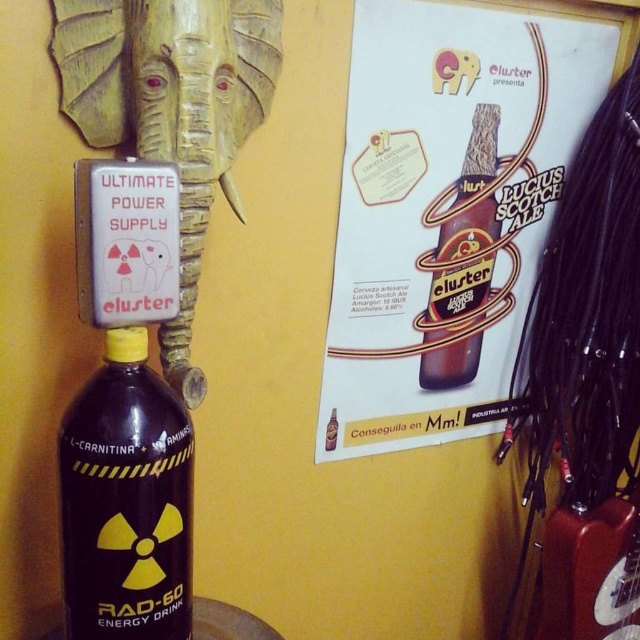
Question: Does matte paper poster at upper right appear under brown glass bottle at upper center?

Choices:
 (A) yes
 (B) no

Answer: (B)

Question: Is matte paper poster at upper right bigger than wooden elephant head at upper left?

Choices:
 (A) no
 (B) yes

Answer: (B)

Question: Considering the real-world distances, which object is farthest from the wooden elephant head at upper left?

Choices:
 (A) matte paper poster at upper right
 (B) brown glass bottle at upper center
 (C) black matte bottle at lower left

Answer: (B)

Question: Which object is the closest to the wooden elephant head at upper left?

Choices:
 (A) matte paper poster at upper right
 (B) brown glass bottle at upper center
 (C) black matte bottle at lower left

Answer: (C)

Question: Which point is closer to the camera?

Choices:
 (A) (378, 371)
 (B) (148, 429)
 (C) (429, 308)
 (D) (84, 81)

Answer: (B)

Question: Does wooden elephant head at upper left have a larger size compared to black matte bottle at lower left?

Choices:
 (A) no
 (B) yes

Answer: (B)